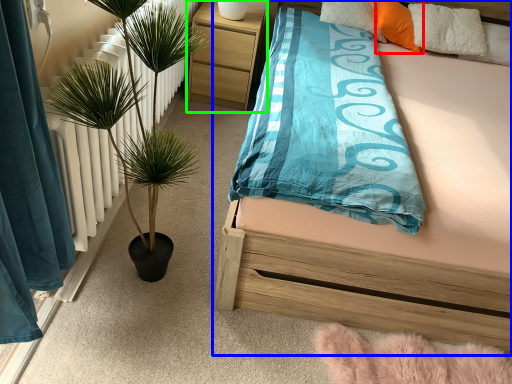
Question: Estimate the real-world distances between objects in this image. Which object is closer to pillow (highlighted by a red box), bed (highlighted by a blue box) or nightstand (highlighted by a green box)?

Choices:
 (A) bed
 (B) nightstand

Answer: (B)